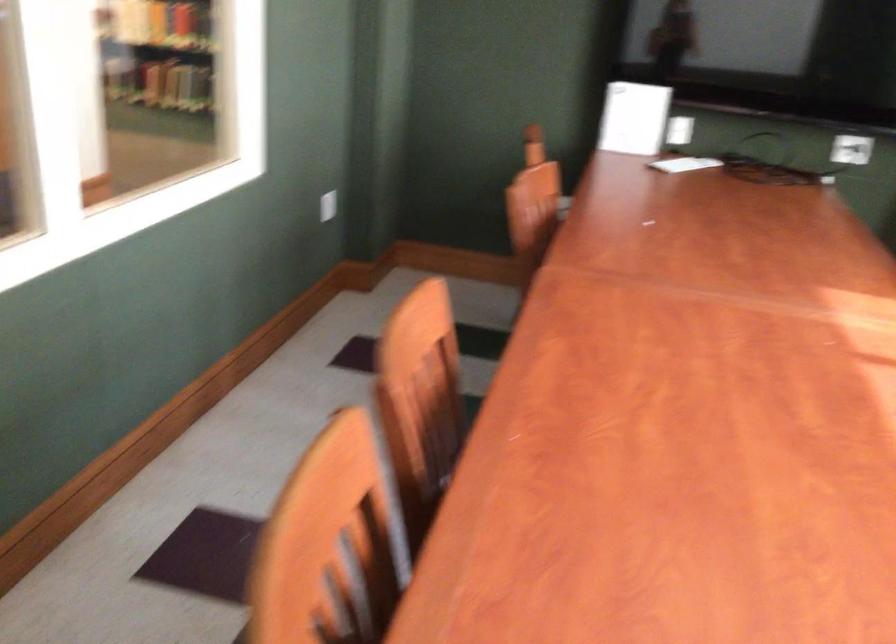
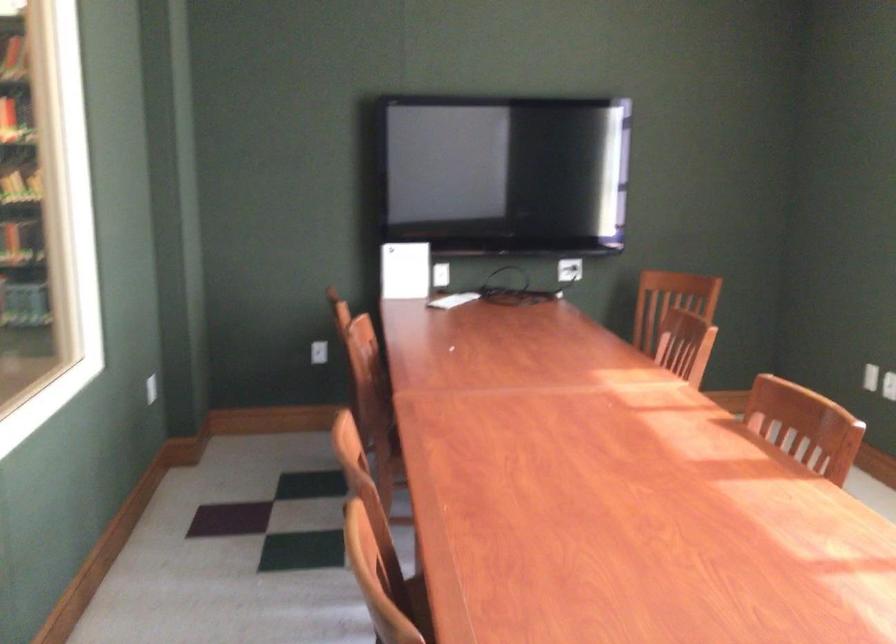
Looking at this image, the images are taken continuously from a first-person perspective. In which direction are you moving?

The movement direction of the cameraman is left, backward.